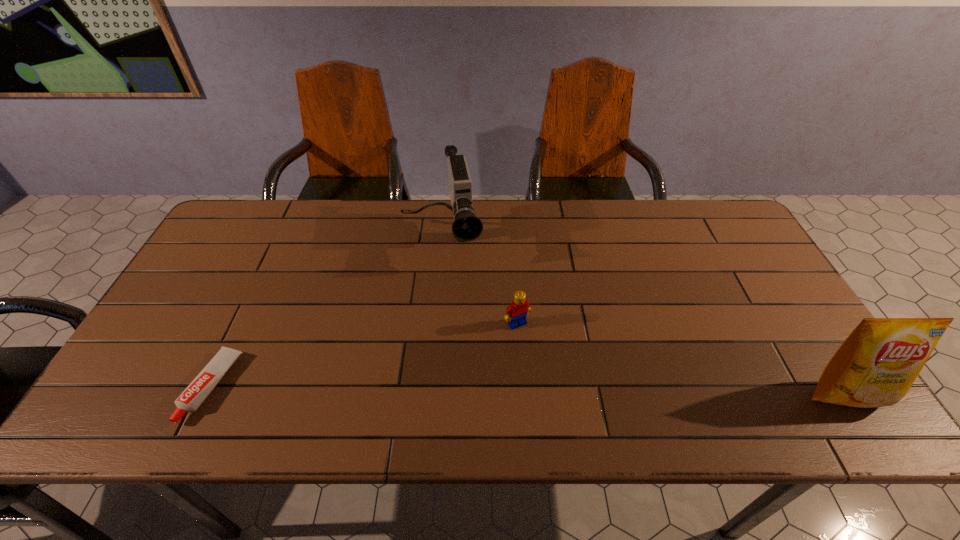
Image resolution: width=960 pixels, height=540 pixels. I want to click on the shortest object, so coord(192,397).

Where is `the leftmost object`? the leftmost object is located at coordinates (192, 397).

Identify the location of the rightmost object. The image size is (960, 540). (876, 365).

Identify the location of the second object from left to right. This screenshot has width=960, height=540. (467, 226).

Where is `camcorder`? camcorder is located at coordinates (467, 226).

This screenshot has height=540, width=960. Find the location of `the third tallest object`. the third tallest object is located at coordinates (516, 313).

The image size is (960, 540). Find the location of `the second object from right to left`. the second object from right to left is located at coordinates (516, 313).

Where is `vacant space situated 0.330m on the back of the leftmost object`? vacant space situated 0.330m on the back of the leftmost object is located at coordinates (273, 259).

Find the location of a particular element. vacant region located 0.190m on the recording direction of the third object from right to left is located at coordinates (453, 325).

Where is `vacant space located on the recording direction of the third object from right to left`? This screenshot has height=540, width=960. vacant space located on the recording direction of the third object from right to left is located at coordinates (453, 327).